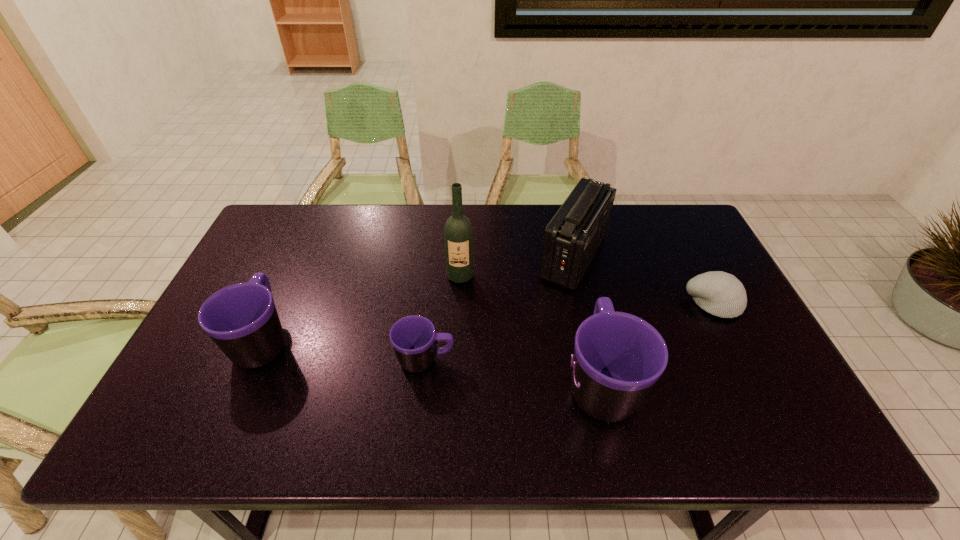
In the current image, all mugs are evenly spaced. To maintain this equal spacing, where should an additional mug be placed on the right? Please point out a free spot. Please provide its 2D coordinates. Your answer should be formatted as a tuple, i.e. [(x, y)], where the tuple contains the x and y coordinates of a point satisfying the conditions above.

[(791, 406)]